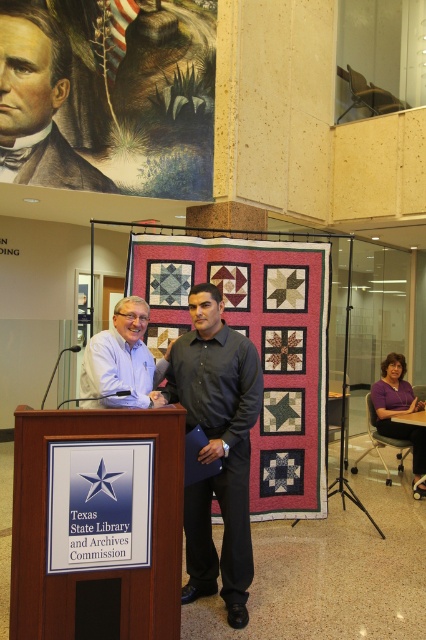
Question: Does quilted fabric quilt at center appear under purple fabric at lower right?

Choices:
 (A) no
 (B) yes

Answer: (A)

Question: Based on their relative distances, which object is farther from the purple fabric at lower right?

Choices:
 (A) colored paper portrait at upper left
 (B) quilted fabric quilt at center
 (C) matte blue shirt at center
 (D) wooden podium at center

Answer: (D)

Question: From the image, what is the correct spatial relationship of black smooth shirt at center in relation to matte blue shirt at center?

Choices:
 (A) above
 (B) below

Answer: (B)

Question: Which is farther from the colored paper portrait at upper left?

Choices:
 (A) matte blue shirt at center
 (B) black smooth shirt at center
 (C) wooden podium at center

Answer: (C)

Question: Is wooden podium at center positioned before quilted fabric quilt at center?

Choices:
 (A) yes
 (B) no

Answer: (A)

Question: Among these points, which one is farthest from the camera?

Choices:
 (A) (161, 118)
 (B) (230, 420)
 (C) (308, 352)

Answer: (A)